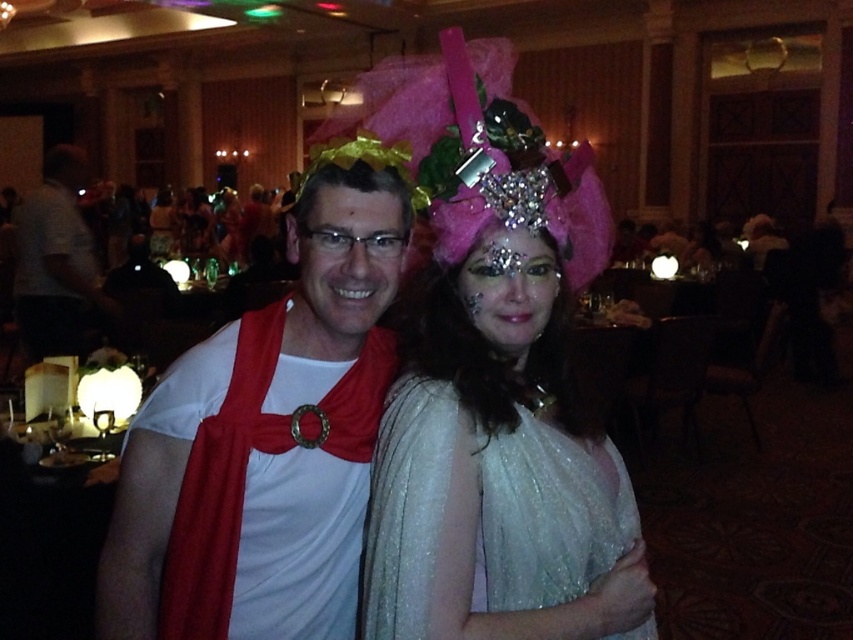
Between white sequined dress at center and white matte tunic at center, which one has less height?

Standing shorter between the two is white sequined dress at center.

Does white sequined dress at center have a greater height compared to white matte tunic at center?

In fact, white sequined dress at center may be shorter than white matte tunic at center.

Describe the element at coordinates (480, 516) in the screenshot. I see `white sequined dress at center` at that location.

Identify the location of white sequined dress at center. This screenshot has width=853, height=640. (x=480, y=516).

Based on the photo, can you confirm if white matte toga at center is thinner than pink tulle headdress at center?

Correct, white matte toga at center's width is less than pink tulle headdress at center's.

Between white matte toga at center and pink tulle headdress at center, which one appears on the left side from the viewer's perspective?

From the viewer's perspective, white matte toga at center appears more on the left side.

Find the location of a particular element. The height and width of the screenshot is (640, 853). white matte toga at center is located at coordinates 265,442.

Is white sequined dress at center to the left of pink tulle headdress at center from the viewer's perspective?

In fact, white sequined dress at center is to the right of pink tulle headdress at center.

Describe the element at coordinates (480, 516) in the screenshot. The image size is (853, 640). I see `white sequined dress at center` at that location.

Find the location of `white sequined dress at center`. white sequined dress at center is located at coordinates (480, 516).

Locate an element on the screen. Image resolution: width=853 pixels, height=640 pixels. white sequined dress at center is located at coordinates (480, 516).